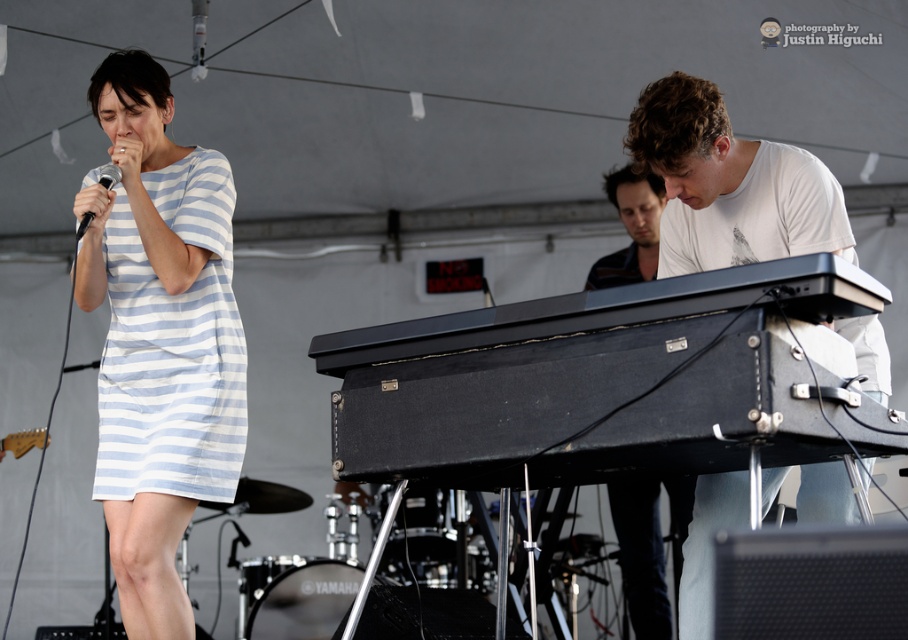
You are standing at the front of the stage during a live music performance. There is a point at coordinates point [194,154] that you want to reach. Can you estimate how far it is from your current position?

The distance of point [194,154] from the camera is 13.69 feet, so the point is approximately 13.69 feet away from your current position.